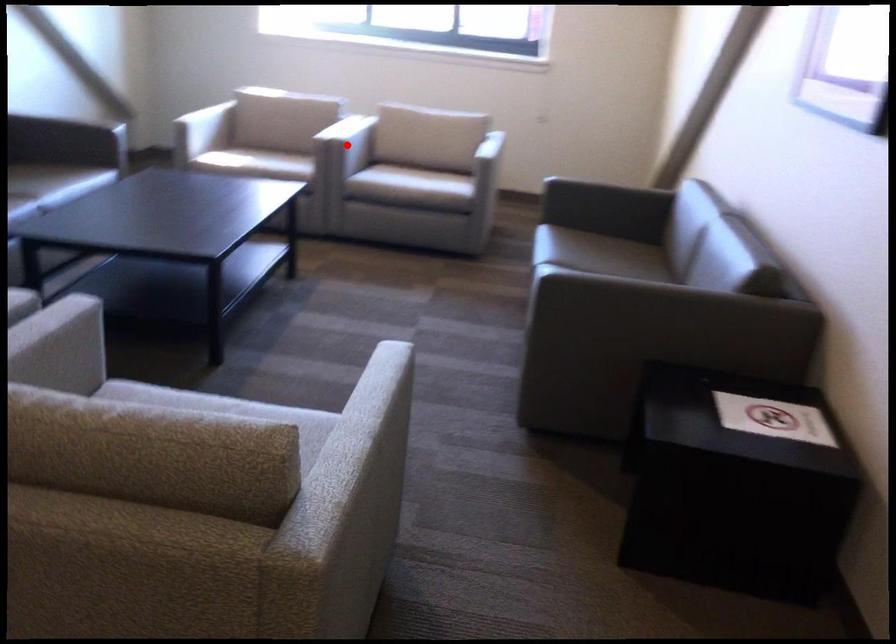
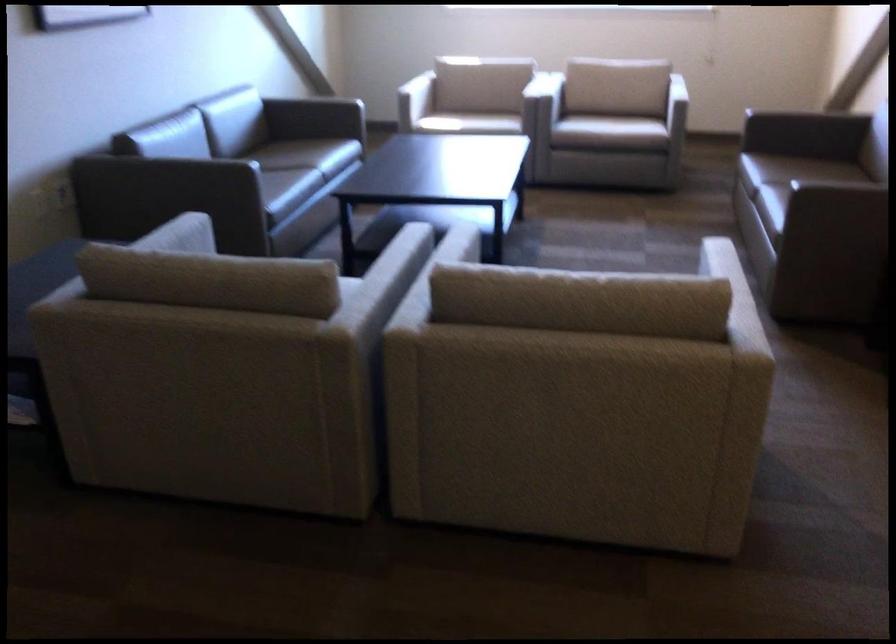
Question: I am providing you with two images of the same scene from different viewpoints. A red point is marked on the first image. Can you still see the location of the red point in image 2?

Choices:
 (A) Yes
 (B) No

Answer: (B)